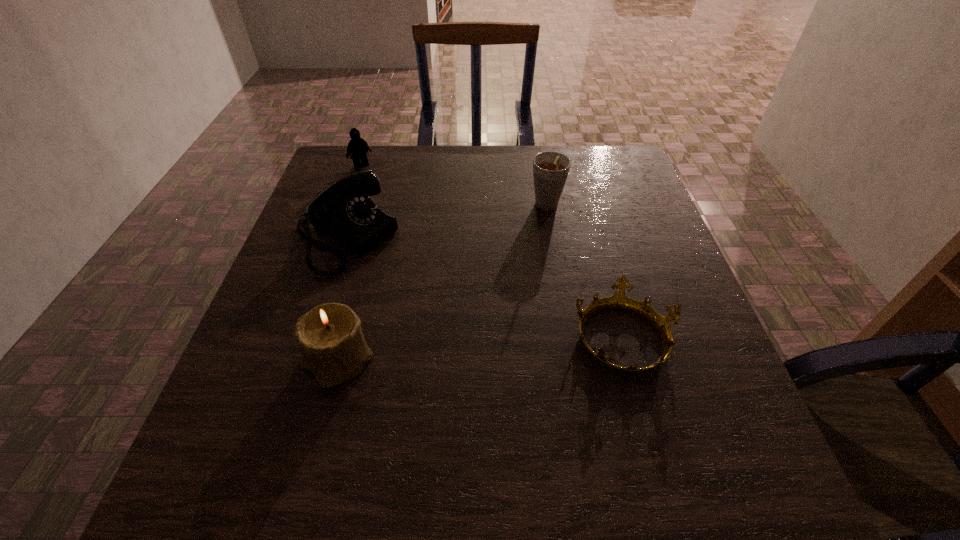
Locate an element on the screen. This screenshot has height=540, width=960. candle_holder is located at coordinates (329, 336).

Find the location of a particular element. Image resolution: width=960 pixels, height=540 pixels. crown is located at coordinates (619, 301).

This screenshot has width=960, height=540. I want to click on telephone, so click(x=344, y=210).

I want to click on Lego, so click(358, 147).

Locate an element on the screen. This screenshot has height=540, width=960. the farthest object is located at coordinates (358, 147).

Find the location of a particular element. root beer is located at coordinates (550, 168).

Identify the location of free spot located 0.050m on the back of the candle_holder. (349, 315).

Locate an element on the screen. This screenshot has width=960, height=540. vacant space located on the back of the crown is located at coordinates (604, 270).

You are a GUI agent. You are given a task and a screenshot of the screen. Output one action in this format:
    pyautogui.click(x=<x>, y=<y>)
    Task: Click on the free space located on the dial of the telephone
    Image resolution: width=960 pixels, height=540 pixels.
    Given the screenshot: What is the action you would take?
    pyautogui.click(x=498, y=335)

Locate an element on the screen. The height and width of the screenshot is (540, 960). vacant position located on the dial of the telephone is located at coordinates (463, 313).